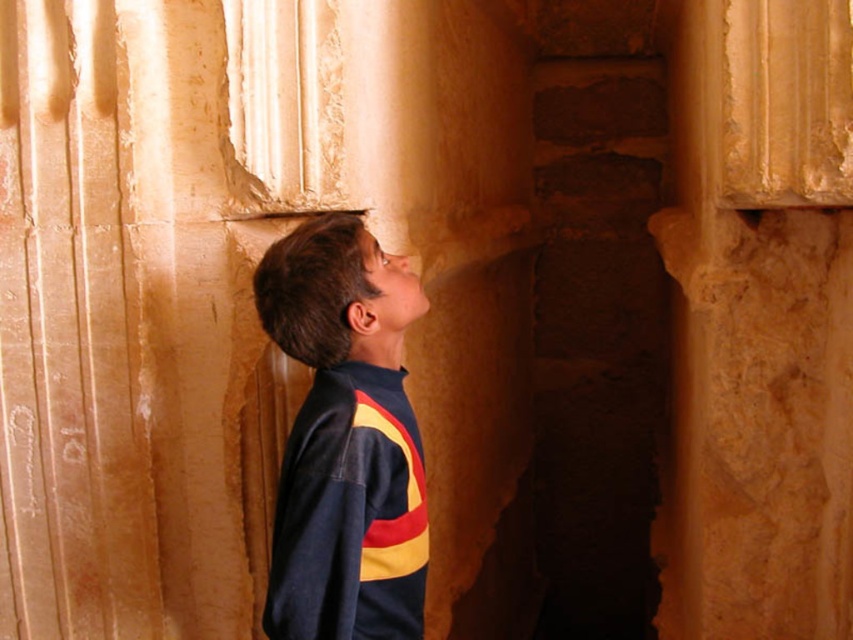
Question: Which point is farther to the camera?

Choices:
 (A) (692, 486)
 (B) (300, 456)

Answer: (A)

Question: Can you confirm if smooth stone column at center is positioned to the left of dark blue fleece at center?

Choices:
 (A) no
 (B) yes

Answer: (A)

Question: Which point is closer to the camera?

Choices:
 (A) (828, 141)
 (B) (338, 451)

Answer: (B)

Question: Does smooth stone column at center appear over dark blue fleece at center?

Choices:
 (A) yes
 (B) no

Answer: (A)

Question: Is smooth stone column at center behind dark blue fleece at center?

Choices:
 (A) no
 (B) yes

Answer: (B)